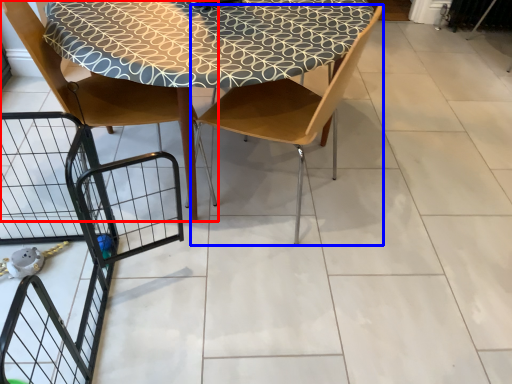
Question: Which point is closer to the camera, chair (highlighted by a red box) or chair (highlighted by a blue box)?

Choices:
 (A) chair
 (B) chair

Answer: (B)